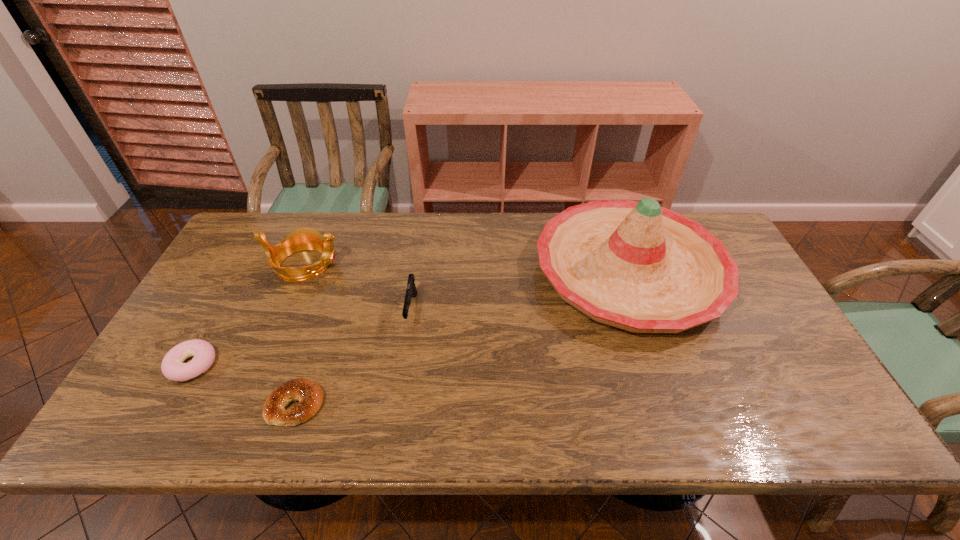
Where is `vacant space located 0.080m on the back of the doughnut`? vacant space located 0.080m on the back of the doughnut is located at coordinates [216, 322].

The width and height of the screenshot is (960, 540). In order to click on vacant region located on the right of the bagel in this screenshot , I will do `click(354, 404)`.

The height and width of the screenshot is (540, 960). In order to click on sombrero positioned at the far edge in this screenshot , I will do `click(636, 266)`.

Find the location of a particular element. tiara that is at the far edge is located at coordinates (305, 238).

The image size is (960, 540). Find the location of `object that is at the near edge`. object that is at the near edge is located at coordinates (309, 394).

Locate an element on the screen. This screenshot has height=540, width=960. tiara that is at the left edge is located at coordinates (305, 238).

I want to click on doughnut that is at the left edge, so click(172, 366).

This screenshot has width=960, height=540. I want to click on object present at the right edge, so (x=636, y=266).

Find the location of `object that is at the far left corner`. object that is at the far left corner is located at coordinates (305, 238).

Find the location of a particular element. object present at the far right corner is located at coordinates (636, 266).